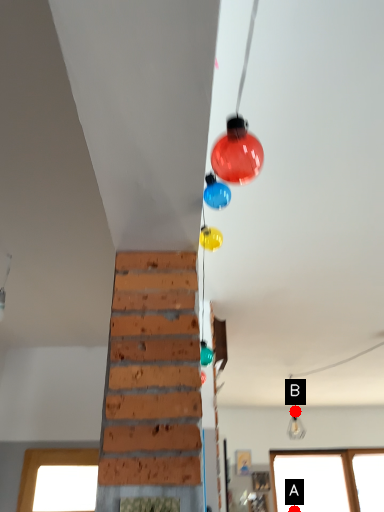
Question: Two points are circled on the image, labeled by A and B beside each circle. Which point is closer to the camera?

Choices:
 (A) A is closer
 (B) B is closer

Answer: (A)